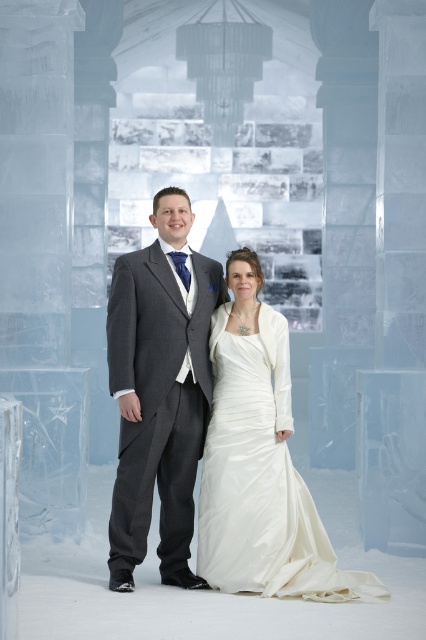
Question: Which of the following is the farthest from the observer?

Choices:
 (A) charcoal gray suit at center
 (B) satin white dress at center
 (C) white satin dress at center

Answer: (A)

Question: Is white satin dress at center further to the viewer compared to satin white dress at center?

Choices:
 (A) yes
 (B) no

Answer: (A)

Question: Among these objects, which one is nearest to the camera?

Choices:
 (A) satin white dress at center
 (B) charcoal gray suit at center
 (C) white satin dress at center

Answer: (A)

Question: Is white satin dress at center behind satin white dress at center?

Choices:
 (A) no
 (B) yes

Answer: (B)

Question: Which object appears closest to the camera in this image?

Choices:
 (A) white satin dress at center
 (B) charcoal gray suit at center

Answer: (A)

Question: Considering the relative positions of white satin dress at center and satin white dress at center in the image provided, where is white satin dress at center located with respect to satin white dress at center?

Choices:
 (A) right
 (B) left

Answer: (B)